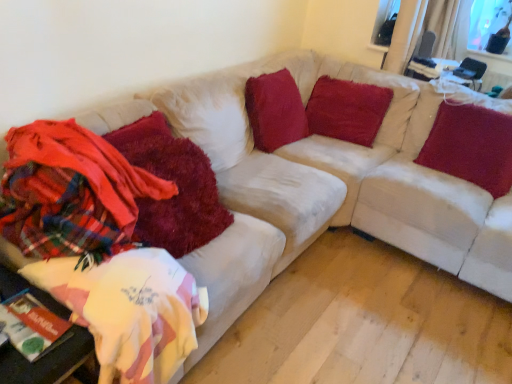
Question: Considering the relative sizes of white fabric table at lower left and shaggy red blanket at left, positioned as the 1th blanket in right-to-left order, in the image provided, is white fabric table at lower left taller than shaggy red blanket at left, positioned as the 1th blanket in right-to-left order,?

Choices:
 (A) yes
 (B) no

Answer: (B)

Question: Considering the relative sizes of white fabric table at lower left and shaggy red blanket at left, positioned as the 1th blanket in right-to-left order, in the image provided, is white fabric table at lower left wider than shaggy red blanket at left, positioned as the 1th blanket in right-to-left order,?

Choices:
 (A) no
 (B) yes

Answer: (B)

Question: Can we say white fabric table at lower left lies outside shaggy red blanket at left, the 2th blanket from the left?

Choices:
 (A) no
 (B) yes

Answer: (B)

Question: Is white fabric table at lower left aimed at shaggy red blanket at left, the 2th blanket from the left?

Choices:
 (A) no
 (B) yes

Answer: (A)

Question: Is shaggy red blanket at left, the 2th blanket from the left, at the back of white fabric table at lower left?

Choices:
 (A) no
 (B) yes

Answer: (A)

Question: Visually, is white fabric table at lower left positioned to the left or to the right of velvety red pillow at upper center, arranged as the first pillow when viewed from the left?

Choices:
 (A) right
 (B) left

Answer: (B)

Question: Is white fabric table at lower left situated inside velvety red pillow at upper center, the third pillow positioned from the right, or outside?

Choices:
 (A) inside
 (B) outside

Answer: (B)

Question: Is point (34, 374) closer or farther from the camera than point (290, 114)?

Choices:
 (A) farther
 (B) closer

Answer: (B)

Question: In terms of width, does white fabric table at lower left look wider or thinner when compared to velvety red pillow at upper center, arranged as the first pillow when viewed from the left?

Choices:
 (A) wide
 (B) thin

Answer: (A)

Question: From a real-world perspective, is shaggy red blanket at left, positioned as the 1th blanket in right-to-left order, positioned above or below velvety red pillow at upper center, the second pillow in the right-to-left sequence?

Choices:
 (A) below
 (B) above

Answer: (B)

Question: Is shaggy red blanket at left, the 2th blanket from the left, bigger or smaller than velvety red pillow at upper center, the second pillow viewed from the left?

Choices:
 (A) small
 (B) big

Answer: (B)

Question: In the image, is shaggy red blanket at left, the 2th blanket from the left, on the left side or the right side of velvety red pillow at upper center, the second pillow viewed from the left?

Choices:
 (A) right
 (B) left

Answer: (B)

Question: In terms of width, does shaggy red blanket at left, the 2th blanket from the left, look wider or thinner when compared to velvety red pillow at upper center, the second pillow in the right-to-left sequence?

Choices:
 (A) thin
 (B) wide

Answer: (B)

Question: From the image's perspective, relative to velvet red pillow at upper right, which is the first pillow from right to left, is shaggy red blanket at left, the 2th blanket from the left, above or below?

Choices:
 (A) above
 (B) below

Answer: (B)

Question: Considering their positions, is shaggy red blanket at left, the 2th blanket from the left, located in front of or behind velvet red pillow at upper right, which is the first pillow from right to left?

Choices:
 (A) front
 (B) behind

Answer: (A)